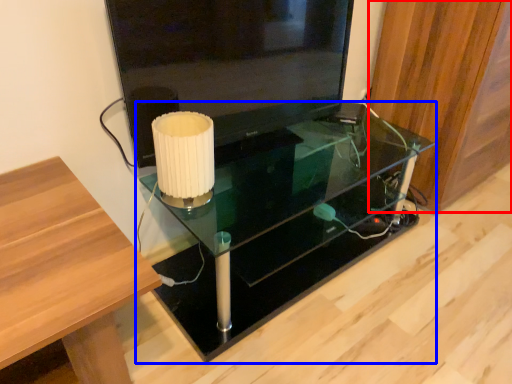
Question: Which point is closer to the camera, wood (highlighted by a red box) or table (highlighted by a blue box)?

Choices:
 (A) wood
 (B) table

Answer: (B)